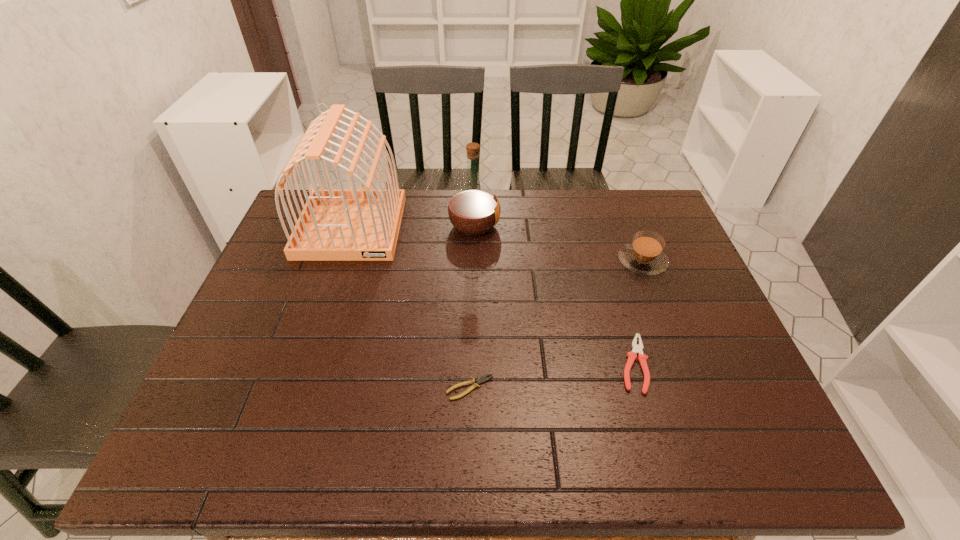
At what (x,y) coordinates should I click in order to perform the action: click on free space that is in between the right pliers and the fourth shortest object. Please return your answer as a coordinate pair (x, y). This screenshot has width=960, height=540. Looking at the image, I should click on (554, 295).

Locate an element on the screen. Image resolution: width=960 pixels, height=540 pixels. free space between the shortest object and the tallest object is located at coordinates pyautogui.click(x=411, y=307).

Where is `vacant region between the liquor and the birdcage`? vacant region between the liquor and the birdcage is located at coordinates (413, 227).

Locate an element on the screen. blank region between the second object from right to left and the cappuccino is located at coordinates (637, 313).

Point out which object is positioned as the nearest to the second object from right to left. Please provide its 2D coordinates. Your answer should be formatted as a tuple, i.e. [(x, y)], where the tuple contains the x and y coordinates of a point satisfying the conditions above.

[(644, 255)]

Find the location of a particular element. The width and height of the screenshot is (960, 540). the closest object to the fourth shortest object is located at coordinates (352, 224).

Locate an element on the screen. vacant position in the image that satisfies the following two spatial constraints: 1. on the front label of the liquor; 2. on the front side of the shortest object is located at coordinates (471, 388).

The image size is (960, 540). I want to click on blank space that satisfies the following two spatial constraints: 1. with an open door on the tallest object; 2. on the left side of the shortest object, so tap(299, 388).

The image size is (960, 540). I want to click on free point that satisfies the following two spatial constraints: 1. on the front label of the rightmost object; 2. on the left side of the second tallest object, so click(473, 261).

In order to click on vacant space that satisfies the following two spatial constraints: 1. on the front label of the fourth shortest object; 2. with an open door on the tallest object in this screenshot , I will do `click(474, 227)`.